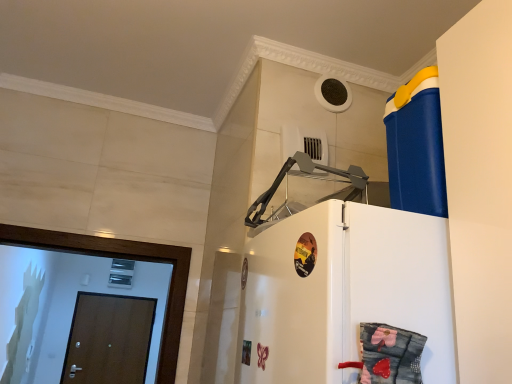
The width and height of the screenshot is (512, 384). What are the coordinates of `brown wooden door at left` in the screenshot? It's located at (109, 339).

Describe the element at coordinates (109, 339) in the screenshot. I see `brown wooden door at left` at that location.

What is the approximate width of brown wooden door at left?

13.54 centimeters.

Measure the distance between point (105,363) and camera.

Point (105,363) is 4.62 meters away from camera.

Image resolution: width=512 pixels, height=384 pixels. Identify the location of brown wooden door at left. (109, 339).